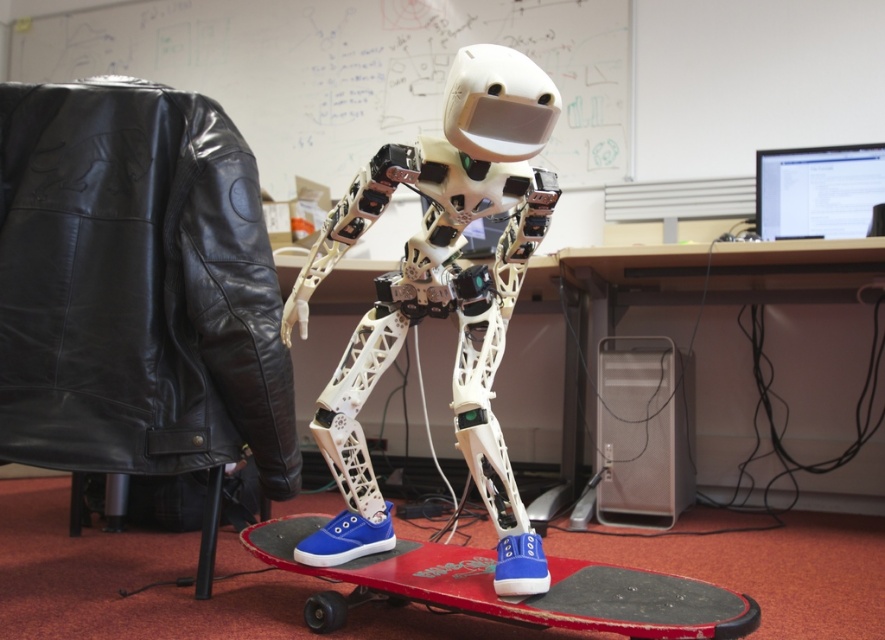
You are a visitor in the lab and want to take a photo of the white matte robot at center without any obstructions. Is the black leather jacket at left blocking your view of the robot?

The white matte robot at center is behind the black leather jacket at left, so the jacket is blocking the view of the robot. Move the jacket or reposition yourself to capture an unobstructed image.